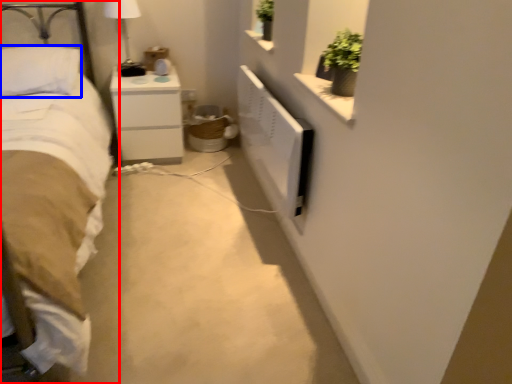
Question: Among these objects, which one is farthest to the camera, bed (highlighted by a red box) or pillow (highlighted by a blue box)?

Choices:
 (A) bed
 (B) pillow

Answer: (B)